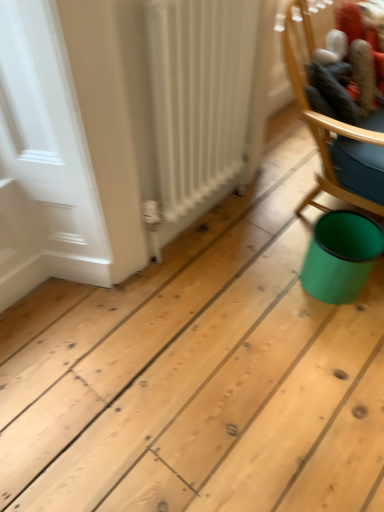
Question: From a real-world perspective, is wooden chair at upper right above or below teal plastic can at lower right?

Choices:
 (A) below
 (B) above

Answer: (B)

Question: Is wooden chair at upper right inside or outside of teal plastic can at lower right?

Choices:
 (A) outside
 (B) inside

Answer: (A)

Question: Considering the real-world distances, which object is farthest from the white matte radiator at left?

Choices:
 (A) wooden chair at upper right
 (B) teal plastic can at lower right

Answer: (B)

Question: Which is nearer to the wooden chair at upper right?

Choices:
 (A) teal plastic can at lower right
 (B) white matte radiator at left

Answer: (A)